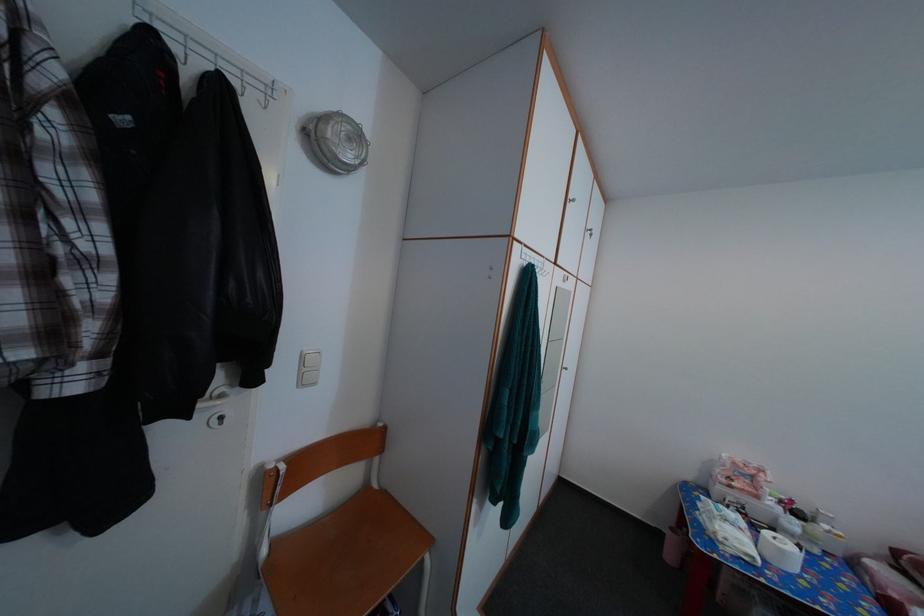
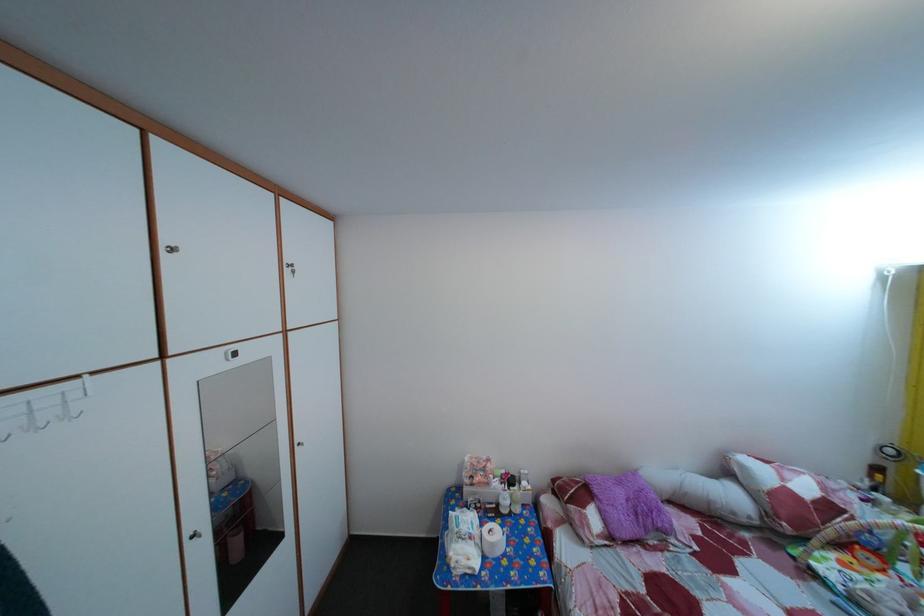
The point at [810,519] is marked in the first image. Where is the corresponding point in the second image?

(524, 485)